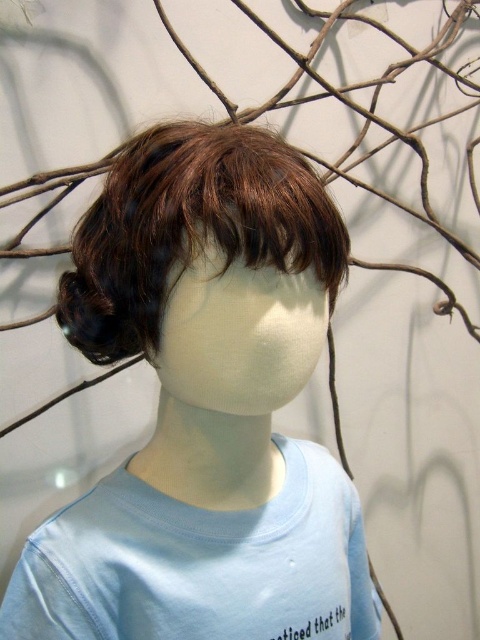
This screenshot has width=480, height=640. Describe the element at coordinates (204, 406) in the screenshot. I see `brown synthetic wig at center` at that location.

Is point (272, 536) less distant than point (299, 616)?

No.

Where is `brown synthetic wig at center`? The height and width of the screenshot is (640, 480). brown synthetic wig at center is located at coordinates (204, 406).

Does light blue cotton t-shirt at center appear over brown matte wig at center?

No.

Is light blue cotton t-shirt at center taller than brown matte wig at center?

Correct, light blue cotton t-shirt at center is much taller as brown matte wig at center.

What do you see at coordinates (200, 563) in the screenshot? The height and width of the screenshot is (640, 480). I see `light blue cotton t-shirt at center` at bounding box center [200, 563].

Identify the location of light blue cotton t-shirt at center. (200, 563).

Between brown synthetic wig at center and brown matte wig at center, which one appears on the left side from the viewer's perspective?

From the viewer's perspective, brown matte wig at center appears more on the left side.

Who is more distant from viewer, (301, 336) or (156, 243)?

Positioned behind is point (301, 336).

Where is `brown synthetic wig at center`? brown synthetic wig at center is located at coordinates (204, 406).